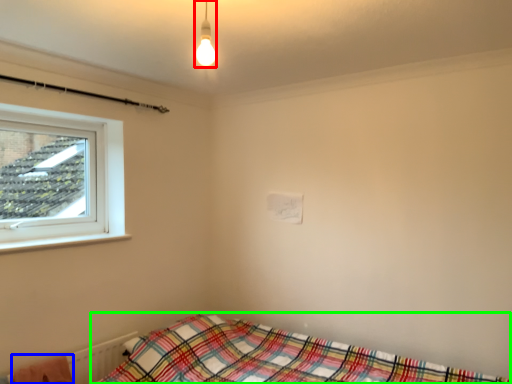
Question: Based on their relative distances, which object is nearer to light fixture (highlighted by a red box)? Choose from blanket (highlighted by a blue box) and bed (highlighted by a green box).

Choices:
 (A) blanket
 (B) bed

Answer: (B)